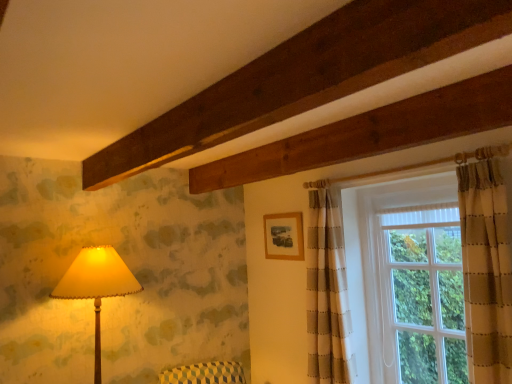
Question: In terms of height, does matte cream lampshade at left look taller or shorter compared to wooden frame at upper center?

Choices:
 (A) tall
 (B) short

Answer: (A)

Question: In terms of width, does matte cream lampshade at left look wider or thinner when compared to wooden frame at upper center?

Choices:
 (A) wide
 (B) thin

Answer: (A)

Question: Based on their relative distances, which object is nearer to the clear glass window at right, arranged as the 2th window when viewed from the left?

Choices:
 (A) matte cream lampshade at left
 (B) white textured glass window at upper right, the 1th window positioned from the left
 (C) wooden frame at upper center

Answer: (B)

Question: Which object is the closest to the clear glass window at right, arranged as the 2th window when viewed from the left?

Choices:
 (A) white textured glass window at upper right, which ranks as the second window in right-to-left order
 (B) wooden frame at upper center
 (C) matte cream lampshade at left

Answer: (A)